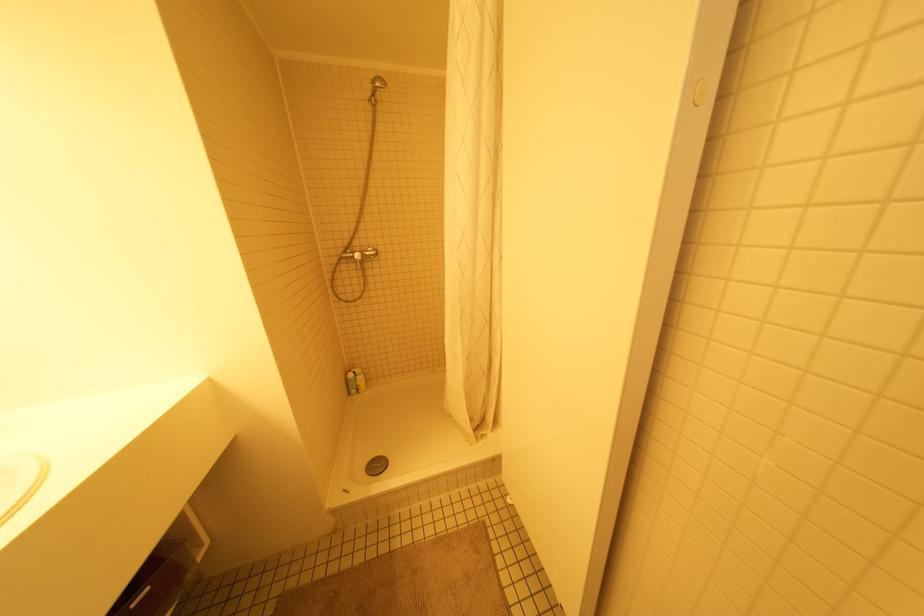
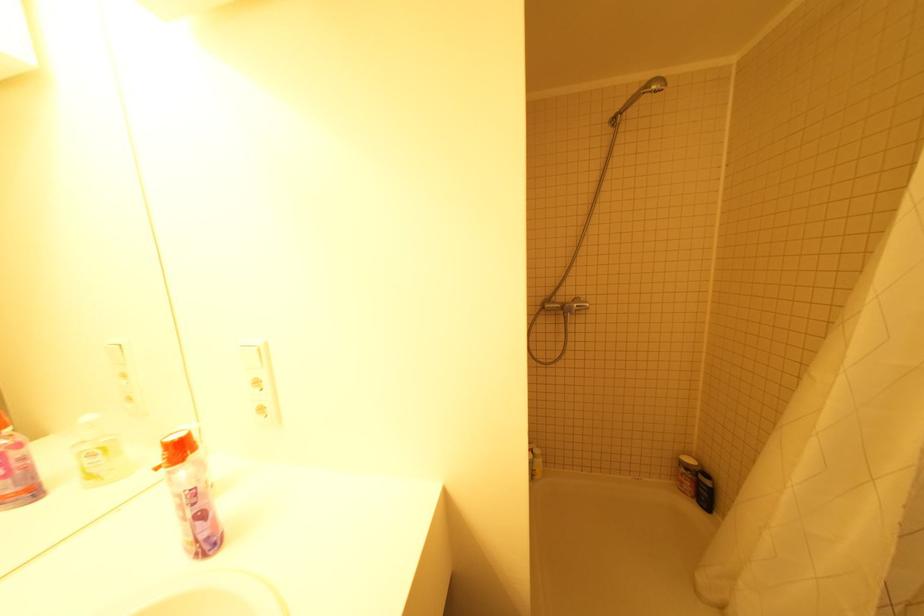
Question: Based on the continuous images, in which direction is the camera rotating? Reply with the corresponding letter.

Choices:
 (A) Left
 (B) Right
 (C) Up
 (D) Down

Answer: (A)